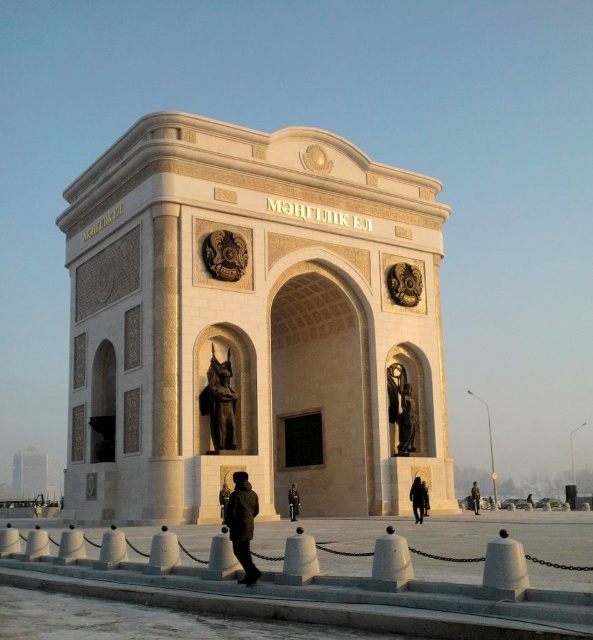
Describe the element at coordinates (243, 524) in the screenshot. I see `dark brown leather jacket at center` at that location.

Is dark brown leather jacket at center positioned behind satin gold statue at center?

No, it is in front of satin gold statue at center.

Image resolution: width=593 pixels, height=640 pixels. In order to click on dark brown leather jacket at center in this screenshot , I will do `click(243, 524)`.

The image size is (593, 640). In order to click on dark brown leather jacket at center in this screenshot , I will do `click(243, 524)`.

Can you confirm if satin gold statue at center is positioned above black matte person at center?

Yes, satin gold statue at center is above black matte person at center.

Which is more to the left, satin gold statue at center or black matte person at center?

From the viewer's perspective, satin gold statue at center appears more on the left side.

This screenshot has width=593, height=640. In order to click on satin gold statue at center in this screenshot , I will do `click(401, 410)`.

The height and width of the screenshot is (640, 593). I want to click on satin gold statue at center, so click(x=401, y=410).

What do you see at coordinates (243, 524) in the screenshot? The width and height of the screenshot is (593, 640). I see `dark brown leather jacket at center` at bounding box center [243, 524].

Where is `dark brown leather jacket at center`? dark brown leather jacket at center is located at coordinates point(243,524).

Where is `dark brown leather jacket at center`? dark brown leather jacket at center is located at coordinates 243,524.